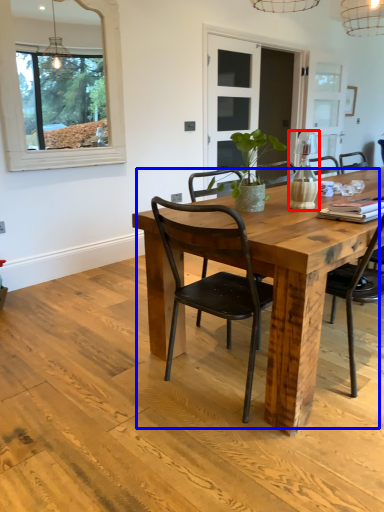
Question: Which object is closer to the camera taking this photo, vase (highlighted by a red box) or kitchen & dining room table (highlighted by a blue box)?

Choices:
 (A) vase
 (B) kitchen & dining room table

Answer: (B)